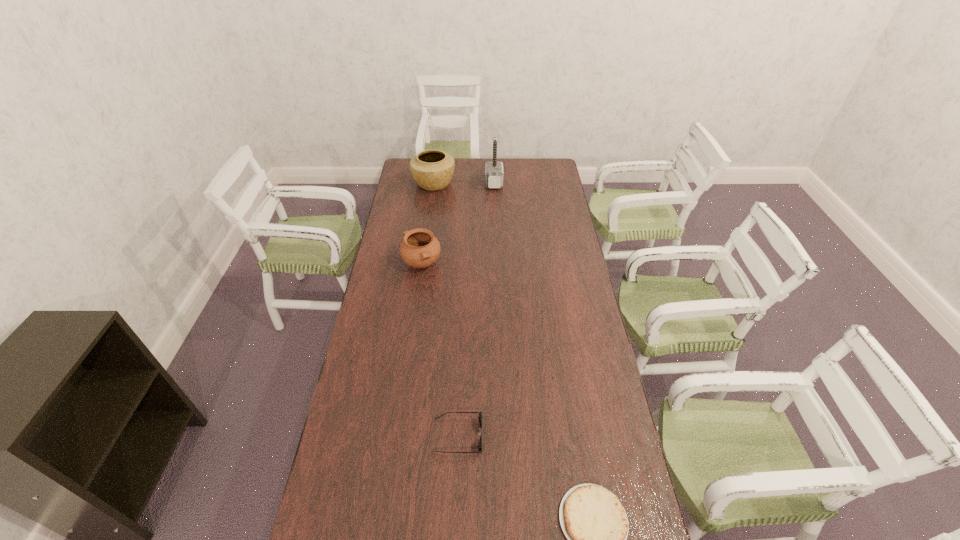
At what (x,y) coordinates should I click in order to perform the action: click on free spot between the second nearest object and the hammer. Please return your answer as a coordinate pair (x, y). This screenshot has width=960, height=540. Looking at the image, I should click on (476, 309).

Locate an element on the screen. The height and width of the screenshot is (540, 960). blank region between the nearer pottery and the fourth tallest object is located at coordinates (440, 350).

At what (x,y) coordinates should I click in order to perform the action: click on free spot between the farther pottery and the nearer pottery. Please return your answer as a coordinate pair (x, y). Image resolution: width=960 pixels, height=540 pixels. Looking at the image, I should click on (428, 224).

The height and width of the screenshot is (540, 960). I want to click on free area in between the fourth tallest object and the nearer pottery, so click(x=440, y=350).

Locate an element on the screen. object that ranks as the third closest to the fourth object from left to right is located at coordinates (480, 413).

In order to click on the closest object to the second shortest object in this screenshot , I will do `click(594, 521)`.

Locate an element on the screen. vacant region that satisfies the following two spatial constraints: 1. on the back side of the nearer pottery; 2. on the left side of the farther pottery is located at coordinates click(433, 183).

The width and height of the screenshot is (960, 540). I want to click on free space that satisfies the following two spatial constraints: 1. for striking with the head of the fourth object from left to right; 2. on the front side of the nearer pottery, so click(x=497, y=264).

I want to click on free space that satisfies the following two spatial constraints: 1. for striking with the head of the tallest object; 2. on the front side of the nearer pottery, so click(x=497, y=264).